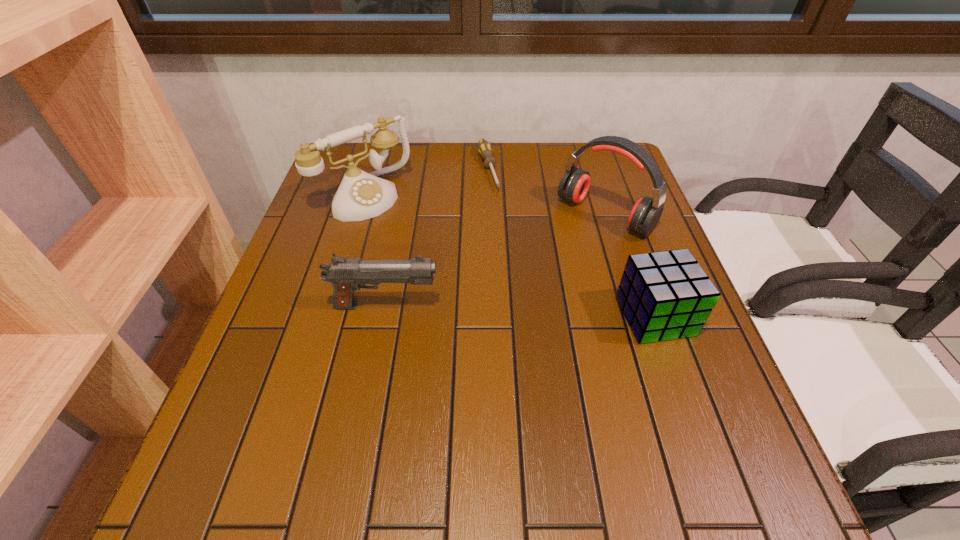
Identify the location of telephone that is at the left edge. The width and height of the screenshot is (960, 540). (361, 195).

At what (x,y) coordinates should I click in order to perform the action: click on cube located in the right edge section of the desktop. Please return your answer as a coordinate pair (x, y). Looking at the image, I should click on (665, 295).

Find the location of `earphone that is at the right edge`. earphone that is at the right edge is located at coordinates (574, 185).

I want to click on object positioned at the far left corner, so click(x=361, y=195).

Image resolution: width=960 pixels, height=540 pixels. I want to click on vacant region at the far edge of the desktop, so click(473, 158).

In order to click on blank area at the near edge in this screenshot , I will do `click(403, 428)`.

I want to click on vacant space at the left edge of the desktop, so click(339, 221).

This screenshot has height=540, width=960. In the image, there is a desktop. Identify the location of vacant region at the right edge. (615, 278).

Locate an element on the screen. This screenshot has height=540, width=960. blank space at the far left corner of the desktop is located at coordinates (364, 147).

In the image, there is a desktop. Where is `vacant space at the far right corner`? The image size is (960, 540). vacant space at the far right corner is located at coordinates (574, 148).